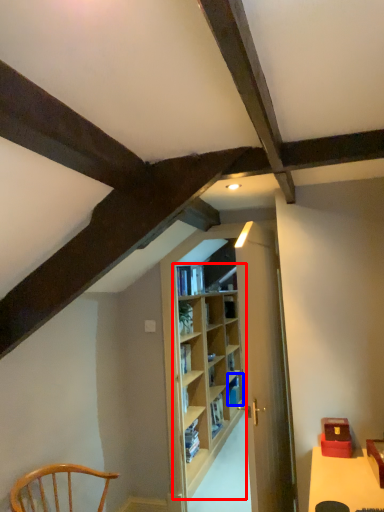
Question: Among these objects, which one is farthest to the camera, shelf (highlighted by a red box) or book (highlighted by a blue box)?

Choices:
 (A) shelf
 (B) book

Answer: (B)